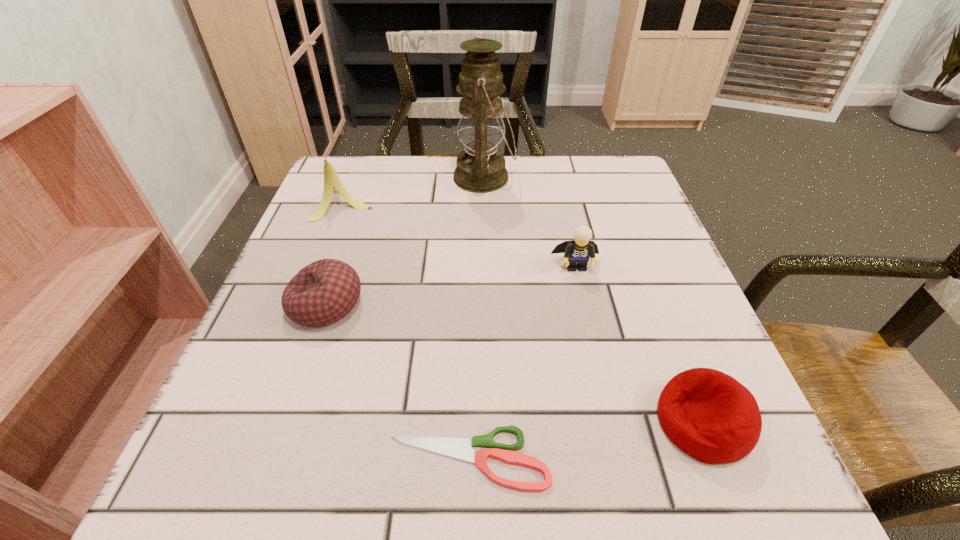
This screenshot has height=540, width=960. I want to click on scissors located in the near edge section of the desktop, so click(x=461, y=449).

I want to click on banana that is at the left edge, so click(332, 182).

Locate an element on the screen. beanbag at the left edge is located at coordinates (x=325, y=291).

This screenshot has width=960, height=540. Find the location of `Lego that is at the right edge`. Lego that is at the right edge is located at coordinates [x=579, y=251].

Locate an element on the screen. The height and width of the screenshot is (540, 960). beanbag at the right edge is located at coordinates (709, 415).

Image resolution: width=960 pixels, height=540 pixels. Identify the location of object present at the far left corner. (332, 182).

I want to click on object that is at the near right corner, so click(709, 415).

In the image, there is a desktop. Where is `free region at the far edge`? The height and width of the screenshot is (540, 960). free region at the far edge is located at coordinates (420, 200).

Image resolution: width=960 pixels, height=540 pixels. Identify the location of vacant area at the near edge. (557, 498).

Find the location of a particular element. The height and width of the screenshot is (540, 960). vacant space at the left edge of the desktop is located at coordinates (267, 354).